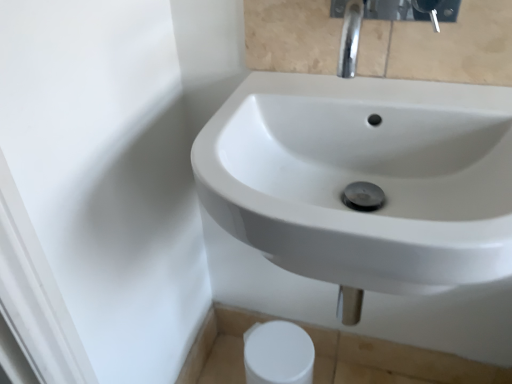
Question: Is white glossy sink at center further to the viewer compared to white matte toilet paper at lower center?

Choices:
 (A) yes
 (B) no

Answer: (B)

Question: From a real-world perspective, is white glossy sink at center below white matte toilet paper at lower center?

Choices:
 (A) yes
 (B) no

Answer: (B)

Question: From a real-world perspective, is white glossy sink at center on top of white matte toilet paper at lower center?

Choices:
 (A) yes
 (B) no

Answer: (A)

Question: Considering the relative positions of white glossy sink at center and white matte toilet paper at lower center in the image provided, is white glossy sink at center in front of white matte toilet paper at lower center?

Choices:
 (A) yes
 (B) no

Answer: (A)

Question: Is white glossy sink at center to the right of white matte toilet paper at lower center from the viewer's perspective?

Choices:
 (A) no
 (B) yes

Answer: (B)

Question: Would you say white glossy sink at center is to the left or to the right of chrome metallic faucet at upper center in the picture?

Choices:
 (A) left
 (B) right

Answer: (A)

Question: Is white glossy sink at center in front of or behind chrome metallic faucet at upper center in the image?

Choices:
 (A) behind
 (B) front

Answer: (B)

Question: From a real-world perspective, is white glossy sink at center above or below chrome metallic faucet at upper center?

Choices:
 (A) below
 (B) above

Answer: (A)

Question: Would you say white glossy sink at center is inside or outside chrome metallic faucet at upper center?

Choices:
 (A) inside
 (B) outside

Answer: (B)

Question: Relative to chrome metallic faucet at upper center, is white matte toilet paper at lower center in front or behind?

Choices:
 (A) behind
 (B) front

Answer: (A)

Question: Looking at their shapes, would you say white matte toilet paper at lower center is wider or thinner than chrome metallic faucet at upper center?

Choices:
 (A) wide
 (B) thin

Answer: (B)

Question: Is white matte toilet paper at lower center to the left or to the right of chrome metallic faucet at upper center in the image?

Choices:
 (A) right
 (B) left

Answer: (B)

Question: From the image's perspective, is white matte toilet paper at lower center located above or below chrome metallic faucet at upper center?

Choices:
 (A) below
 (B) above

Answer: (A)

Question: Looking at the image, does white glossy sink at center seem bigger or smaller compared to white matte toilet paper at lower center?

Choices:
 (A) small
 (B) big

Answer: (B)

Question: Is point (503, 140) closer or farther from the camera than point (261, 382)?

Choices:
 (A) farther
 (B) closer

Answer: (B)